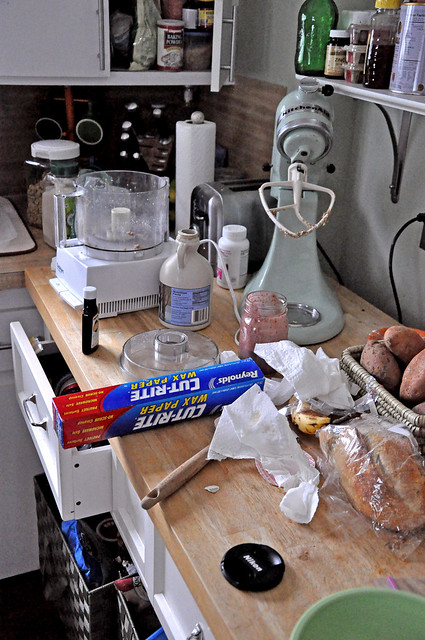
Locate an element on the screen. The width and height of the screenshot is (425, 640). bread maker is located at coordinates (301, 257).